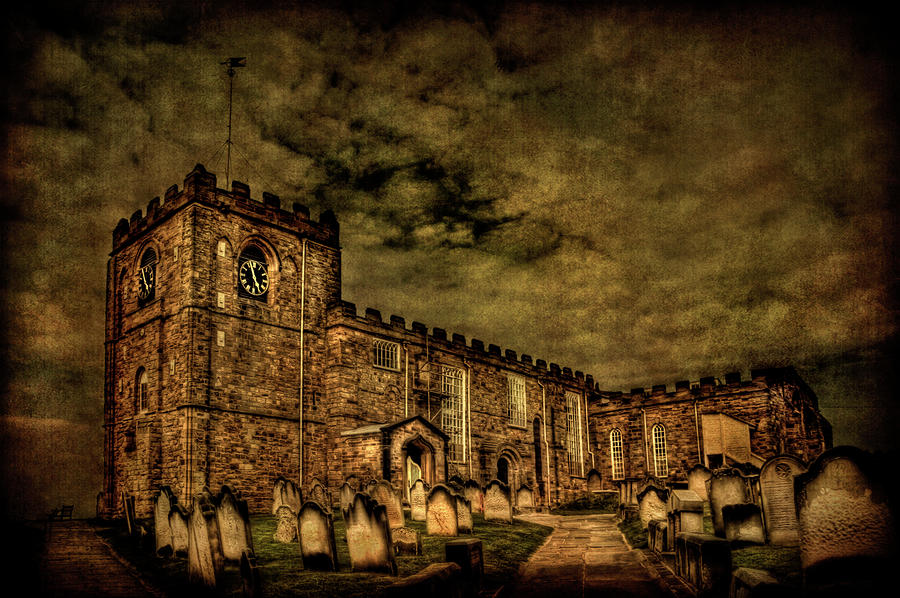
Where is `clocks`? This screenshot has height=598, width=900. clocks is located at coordinates (255, 274), (142, 277).